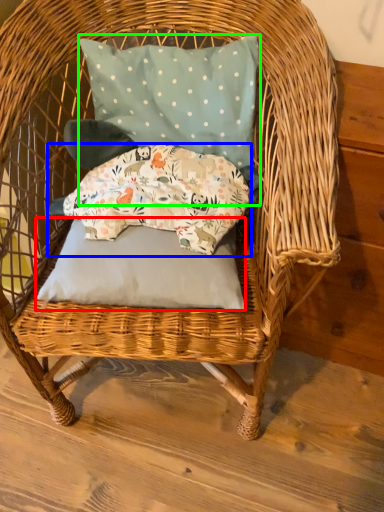
Question: Estimate the real-world distances between objects in this image. Which object is closer to pillow (highlighted by a red box), pillow (highlighted by a blue box) or pillow (highlighted by a green box)?

Choices:
 (A) pillow
 (B) pillow

Answer: (A)